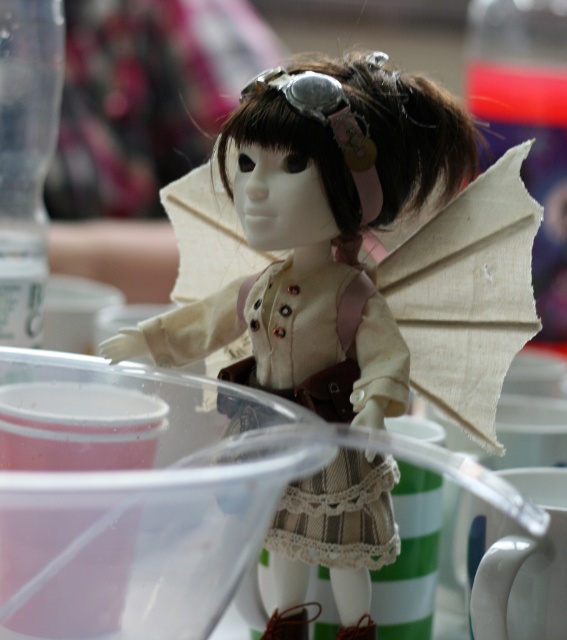
You are a character in a story who needs to retrieve the white ceramic mug at lower right without touching the beige fabric wings at center. Based on their positions, which direction should you move the mug to ensure it doesn

The beige fabric wings at center are to the left of the white ceramic mug at lower right. To move the mug away from the wings, you should move it to the right side.

What is located at the point with coordinates (463, 291) in the image?

The beige fabric wings at center are located at point (463, 291).

You are a character in the image and want to pick up the white ceramic mug at lower right without touching the beige fabric wings at center. Is this possible?

The beige fabric wings at center are in front of the white ceramic mug at lower right, so you can reach around or behind the wings to pick up the mug without touching them.